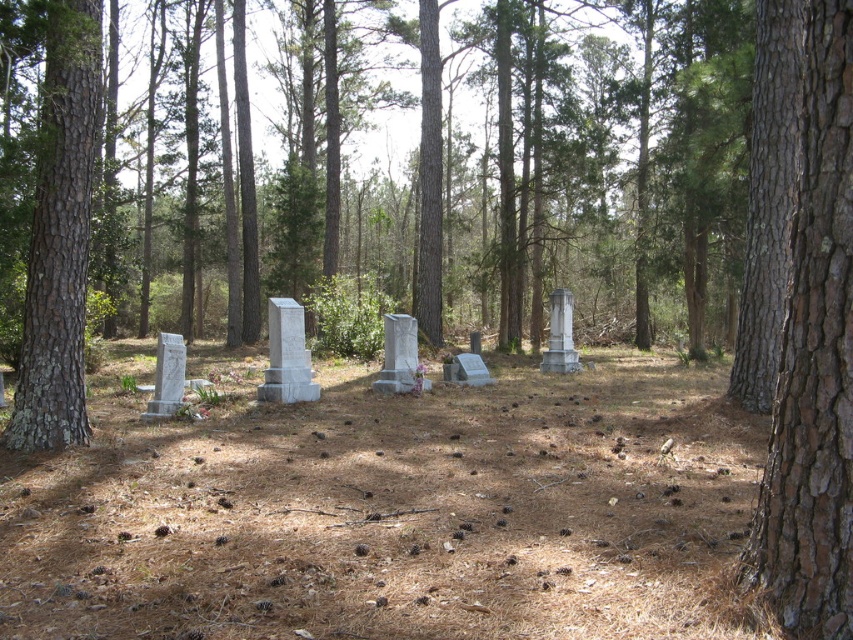
Can you confirm if brown rough bark tree at right is bigger than lichen-covered bark tree at left?

Actually, brown rough bark tree at right might be smaller than lichen-covered bark tree at left.

Based on the photo, who is positioned more to the left, brown rough bark tree at right or lichen-covered bark tree at left?

lichen-covered bark tree at left

This screenshot has width=853, height=640. Describe the element at coordinates (814, 362) in the screenshot. I see `brown rough bark tree at right` at that location.

Image resolution: width=853 pixels, height=640 pixels. Find the location of `brown rough bark tree at right`. brown rough bark tree at right is located at coordinates (814, 362).